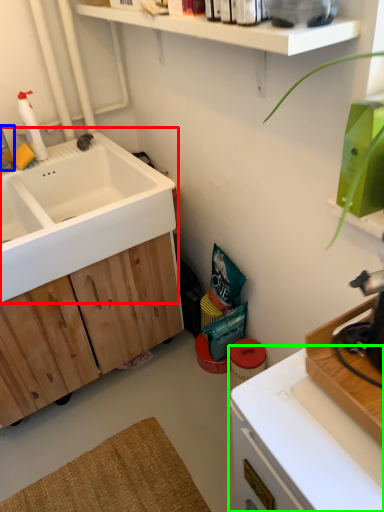
Question: Which is nearer to the sink (highlighted by a red box)? faucet (highlighted by a blue box) or countertop (highlighted by a green box).

Choices:
 (A) faucet
 (B) countertop

Answer: (A)